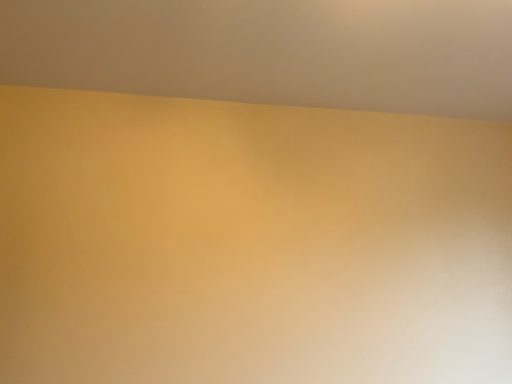
Where is `matte yellow wall at upper center`? The height and width of the screenshot is (384, 512). matte yellow wall at upper center is located at coordinates (271, 51).

This screenshot has width=512, height=384. What do you see at coordinates (271, 51) in the screenshot? I see `matte yellow wall at upper center` at bounding box center [271, 51].

Locate an element on the screen. The width and height of the screenshot is (512, 384). matte yellow wall at upper center is located at coordinates (271, 51).